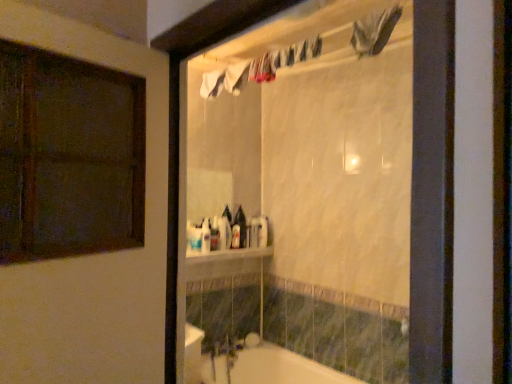
Question: Is white glossy bottle at center, the 1th toiletry in the front-to-back sequence, surrounding white glossy bottle at center, which appears as the fifth toiletry when viewed from the front?

Choices:
 (A) no
 (B) yes

Answer: (A)

Question: Considering the relative sizes of white glossy bottle at center, placed as the fifth toiletry when sorted from right to left, and white glossy bottle at center, which appears as the fifth toiletry when viewed from the front, in the image provided, is white glossy bottle at center, placed as the fifth toiletry when sorted from right to left, smaller than white glossy bottle at center, which appears as the fifth toiletry when viewed from the front,?

Choices:
 (A) no
 (B) yes

Answer: (B)

Question: From the image's perspective, does white glossy bottle at center, placed as the fifth toiletry when sorted from right to left, appear lower than white glossy bottle at center, which is counted as the 5th toiletry, starting from the left?

Choices:
 (A) no
 (B) yes

Answer: (B)

Question: Considering the relative positions of white glossy bottle at center, placed as the fifth toiletry when sorted from right to left, and white glossy bottle at center, which is counted as the 5th toiletry, starting from the left, in the image provided, is white glossy bottle at center, placed as the fifth toiletry when sorted from right to left, to the right of white glossy bottle at center, which is counted as the 5th toiletry, starting from the left, from the viewer's perspective?

Choices:
 (A) yes
 (B) no

Answer: (B)

Question: From the image's perspective, is white glossy bottle at center, the 1th toiletry in the front-to-back sequence, above white glossy bottle at center, which is counted as the 5th toiletry, starting from the left?

Choices:
 (A) no
 (B) yes

Answer: (A)

Question: From a real-world perspective, is white glossy bottle at center, the fifth toiletry from the back, physically above white glossy bottle at center, which is the first toiletry from right to left?

Choices:
 (A) no
 (B) yes

Answer: (A)

Question: Does white glossy shelf at center appear on the right side of white glossy bottle at center, which is counted as the 5th toiletry, starting from the left?

Choices:
 (A) yes
 (B) no

Answer: (B)

Question: From the image's perspective, is white glossy shelf at center on white glossy bottle at center, which is counted as the first toiletry, starting from the back?

Choices:
 (A) no
 (B) yes

Answer: (A)

Question: Is white glossy shelf at center next to white glossy bottle at center, which is counted as the 5th toiletry, starting from the left, and touching it?

Choices:
 (A) no
 (B) yes

Answer: (A)

Question: From a real-world perspective, is white glossy shelf at center positioned under white glossy bottle at center, which is counted as the first toiletry, starting from the back, based on gravity?

Choices:
 (A) no
 (B) yes

Answer: (B)

Question: Can you confirm if white glossy shelf at center is bigger than white glossy bottle at center, which is counted as the first toiletry, starting from the back?

Choices:
 (A) no
 (B) yes

Answer: (B)

Question: Is white glossy bottle at center, which appears as the fifth toiletry when viewed from the front, completely or partially inside white glossy shelf at center?

Choices:
 (A) no
 (B) yes

Answer: (A)

Question: Can you confirm if white glossy bottle at center, the fifth toiletry from the back, is wider than white glossy bathtub at lower center?

Choices:
 (A) no
 (B) yes

Answer: (A)